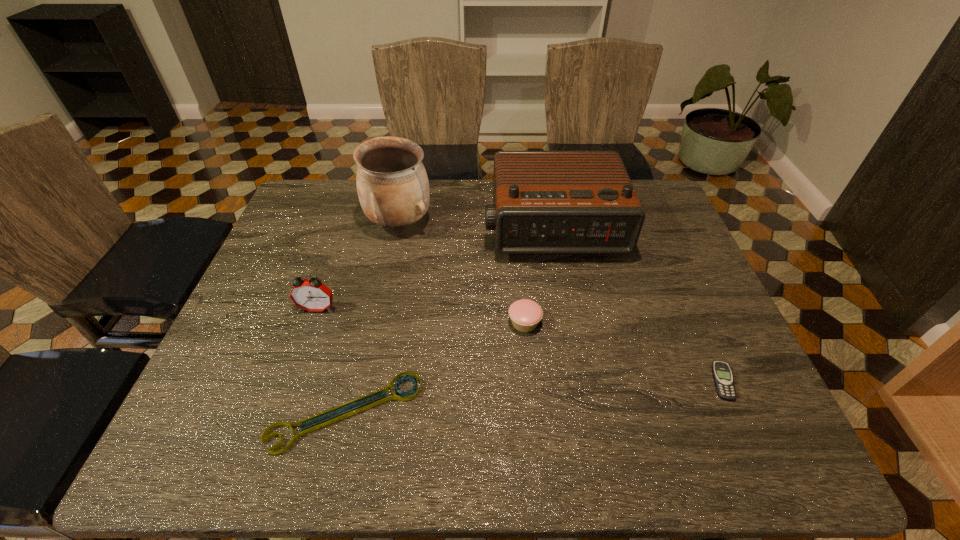
The width and height of the screenshot is (960, 540). Identify the location of urn. (392, 184).

Where is `radio receiver`? This screenshot has height=540, width=960. radio receiver is located at coordinates (545, 202).

This screenshot has height=540, width=960. I want to click on the third tallest object, so click(x=312, y=295).

The image size is (960, 540). I want to click on cupcake, so click(x=525, y=314).

Locate an element on the screen. This screenshot has width=960, height=540. beeper is located at coordinates (722, 375).

Locate an element on the screen. wrench is located at coordinates (x=409, y=395).

I want to click on vacant region located 0.230m on the right of the urn, so click(506, 222).

You are a GUI agent. You are given a task and a screenshot of the screen. Output one action in this format:
    pyautogui.click(x=<x>, y=<y>)
    Task: Click on the vacant point located on the tuning display of the second tallest object
    This screenshot has width=960, height=540.
    Given the screenshot: What is the action you would take?
    (570, 329)

Where is `vacant space located on the clock face of the alarm clock`? This screenshot has width=960, height=540. vacant space located on the clock face of the alarm clock is located at coordinates (296, 373).

Where is `free space located 0.140m on the back of the cupcake`? free space located 0.140m on the back of the cupcake is located at coordinates (520, 272).